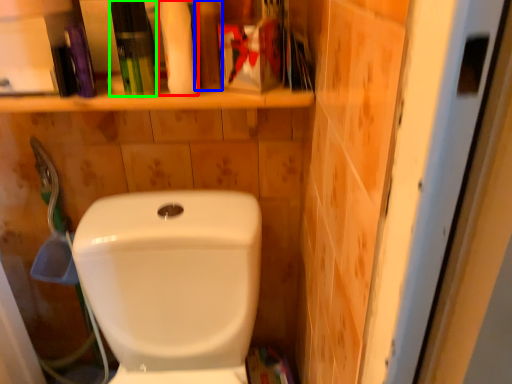
Question: Considering the real-world distances, which object is farthest from cleaning product (highlighted by a red box)? toiletry (highlighted by a blue box) or toiletry (highlighted by a green box)?

Choices:
 (A) toiletry
 (B) toiletry

Answer: (B)